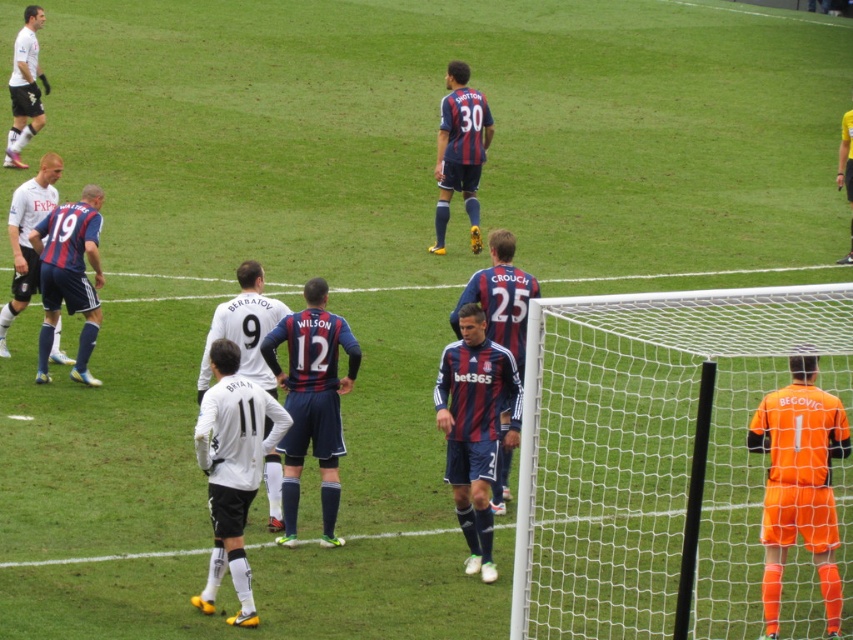
Question: Among these objects, which one is farthest from the camera?

Choices:
 (A) matte blue soccer jersey at center
 (B) matte white jersey at left
 (C) orange matte net at right

Answer: (A)

Question: Among these objects, which one is farthest from the camera?

Choices:
 (A) orange matte jersey at right
 (B) matte white jersey at left
 (C) matte blue jersey at center

Answer: (B)

Question: Is orange matte net at right bigger than striped jersey at center?

Choices:
 (A) no
 (B) yes

Answer: (A)

Question: Observing the image, what is the correct spatial positioning of striped jersey soccer player at center in reference to striped jersey at center?

Choices:
 (A) left
 (B) right

Answer: (A)

Question: Which object appears farthest from the camera in this image?

Choices:
 (A) matte blue jersey at center
 (B) striped jersey soccer player at center
 (C) white jersey at center
 (D) orange matte net at right

Answer: (D)

Question: Can you confirm if striped jersey at center is bigger than white jersey at upper left?

Choices:
 (A) yes
 (B) no

Answer: (B)